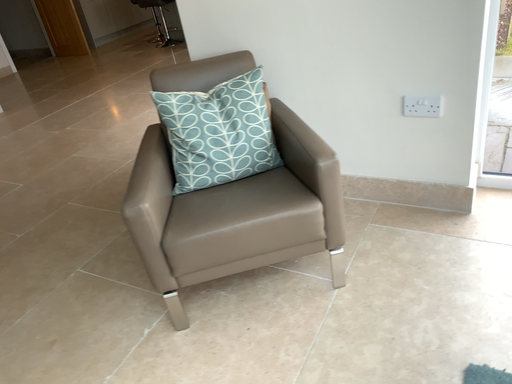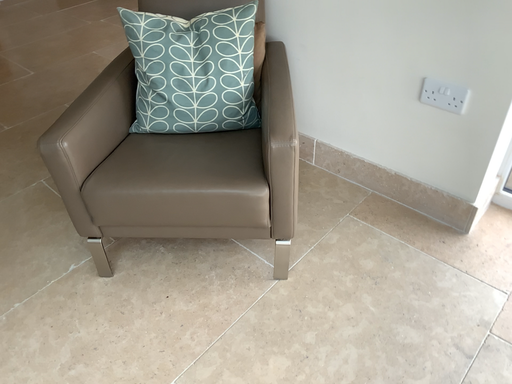
Question: Which way did the camera rotate in the video?

Choices:
 (A) rotated left
 (B) rotated right

Answer: (A)